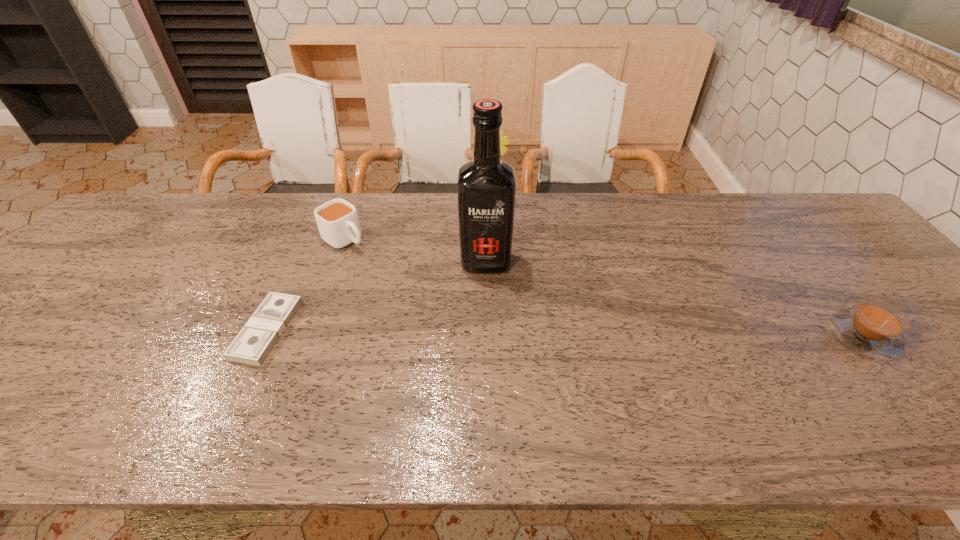
Locate an element on the screen. The width and height of the screenshot is (960, 540). dollar is located at coordinates 254,342.

The height and width of the screenshot is (540, 960). What are the coordinates of `cappuccino` in the screenshot? It's located at (873, 328).

I want to click on the rightmost object, so click(x=873, y=328).

Identify the location of the farthest object. (503, 141).

Where is `the second tallest object`? This screenshot has height=540, width=960. the second tallest object is located at coordinates (503, 141).

You are a GUI agent. You are given a task and a screenshot of the screen. Output one action in this format:
    pyautogui.click(x=<x>, y=<y>)
    Task: Click on the liquor
    This screenshot has height=540, width=960.
    Given the screenshot: What is the action you would take?
    pyautogui.click(x=486, y=185)

This screenshot has width=960, height=540. I want to click on cup, so click(x=337, y=220).

Identify the location of vacant position located 0.210m on the left of the dollar. The width and height of the screenshot is (960, 540). (154, 329).

Identify the location of vacant space located 0.110m on the right of the cappuccino. This screenshot has height=540, width=960. (943, 337).

This screenshot has height=540, width=960. Identify the location of free region located 0.080m on the front-facing side of the second tallest object. (x=502, y=226).